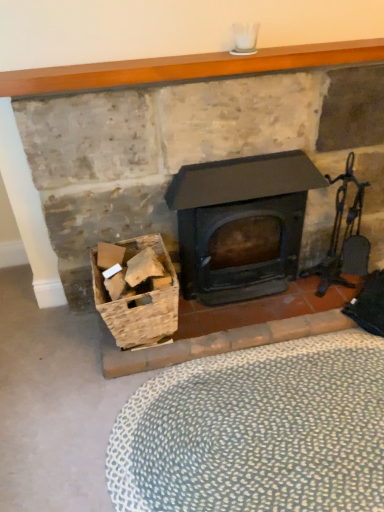
Find the location of a particular element. The height and width of the screenshot is (512, 384). free space that is in between matte black wood burning stove at center and metallic dark brown fireplace tool set at right is located at coordinates (279, 301).